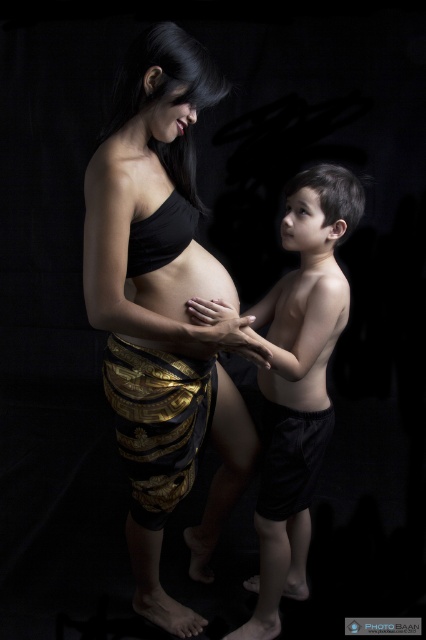
Question: Can you confirm if smooth skin boy at center is positioned to the left of matte skin at center?

Choices:
 (A) no
 (B) yes

Answer: (A)

Question: Observing the image, what is the correct spatial positioning of smooth skin boy at center in reference to matte skin at center?

Choices:
 (A) below
 (B) above

Answer: (A)

Question: Among these points, which one is farthest from the camera?

Choices:
 (A) (236, 296)
 (B) (255, 310)
 (C) (256, 314)

Answer: (B)

Question: Among these objects, which one is farthest from the camera?

Choices:
 (A) black matte fabric at center
 (B) matte skin at center

Answer: (B)

Question: Is black matte fabric at center thinner than matte skin at center?

Choices:
 (A) no
 (B) yes

Answer: (A)

Question: Which point is farther to the camera?

Choices:
 (A) (304, 374)
 (B) (261, 348)
 (C) (204, 260)

Answer: (A)